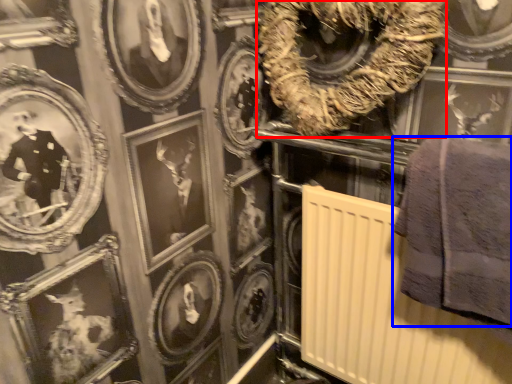
Question: Which of the following is the farthest to the observer, decor (highlighted by a red box) or towel (highlighted by a blue box)?

Choices:
 (A) decor
 (B) towel

Answer: (A)